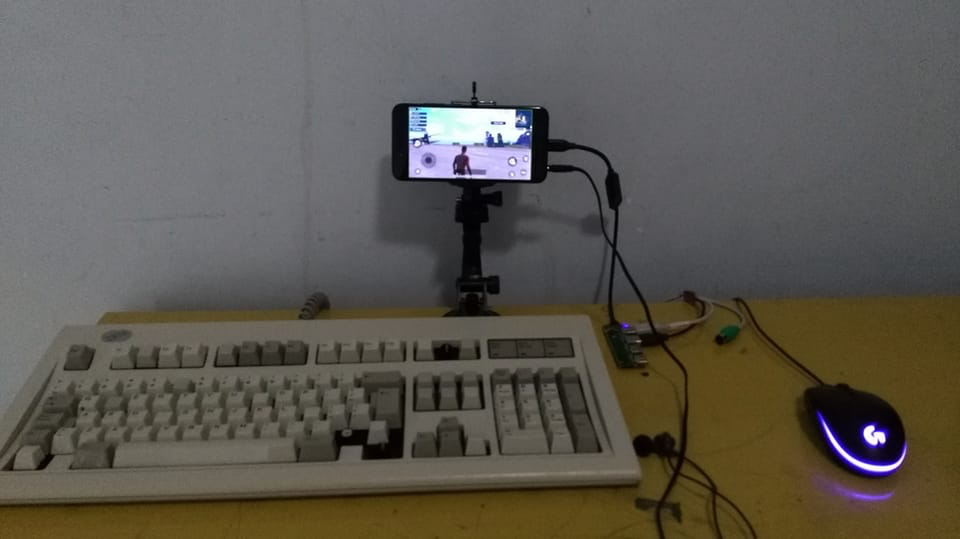
Where is `mouse wire`? The image size is (960, 539). mouse wire is located at coordinates (783, 353).